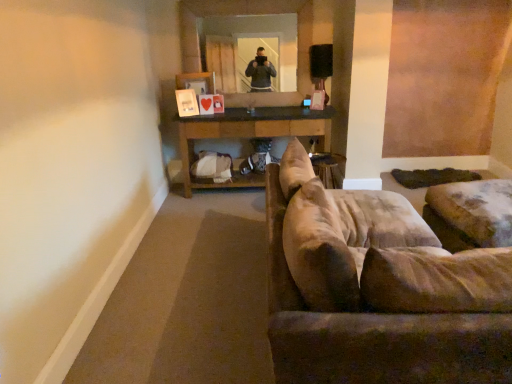
The width and height of the screenshot is (512, 384). I want to click on free space in front of brown wooden table at center, so click(223, 225).